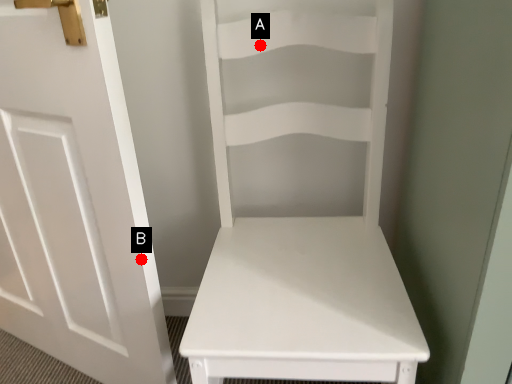
Question: Two points are circled on the image, labeled by A and B beside each circle. Which of the following is the closest to the observer?

Choices:
 (A) A is closer
 (B) B is closer

Answer: (B)